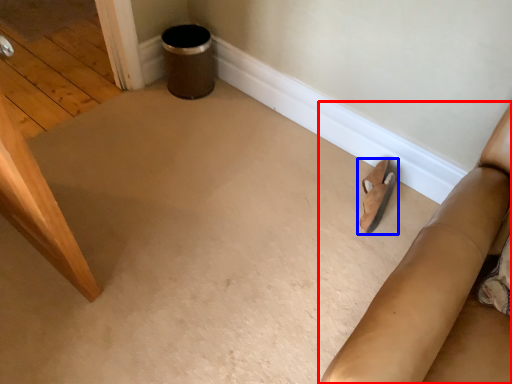
Question: Which point is further to the camera, furniture (highlighted by a red box) or footwear (highlighted by a blue box)?

Choices:
 (A) furniture
 (B) footwear

Answer: (B)